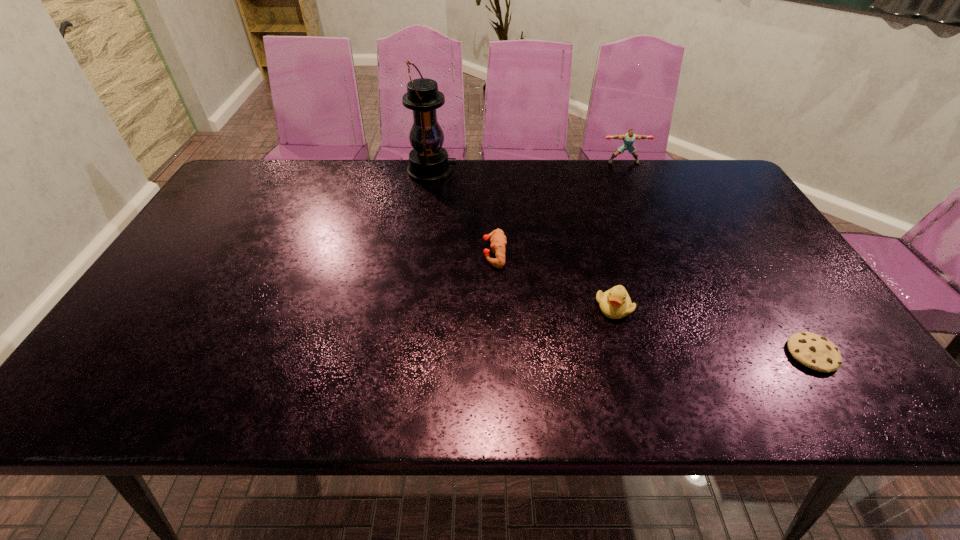
I want to click on the leftmost object, so click(428, 161).

Locate an element on the screen. the tallest object is located at coordinates (428, 161).

Find the location of a particular element. This screenshot has height=540, width=960. the second tallest object is located at coordinates (628, 138).

Where is `the taller puncher`? This screenshot has width=960, height=540. the taller puncher is located at coordinates (628, 138).

Where is `the third object from right to left`? the third object from right to left is located at coordinates (615, 303).

The image size is (960, 540). Identify the location of the fourth farthest object. [615, 303].

Identify the location of the nearer puncher. The width and height of the screenshot is (960, 540). click(498, 240).

Identify the location of the second object from left to right. This screenshot has width=960, height=540. (498, 240).

What are the coordinates of `the rightmost object` in the screenshot? It's located at (814, 351).

Locate an element on the screen. the shortest object is located at coordinates (814, 351).